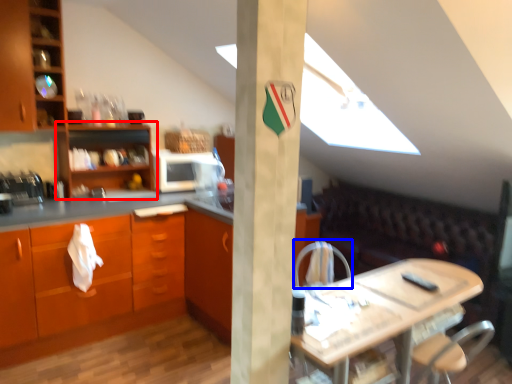
Question: Which object is further to the camera taking this photo, shelf (highlighted by a red box) or armchair (highlighted by a blue box)?

Choices:
 (A) shelf
 (B) armchair

Answer: (A)